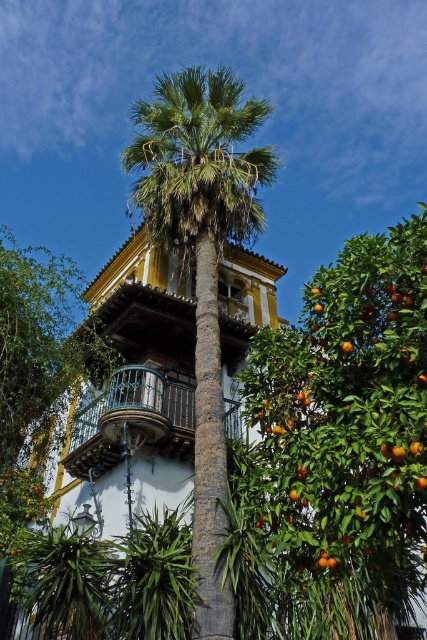
Question: Which of the following is the farthest from the observer?

Choices:
 (A) orange matte/leathery fruit tree at upper right
 (B) black wrought iron balcony at center
 (C) green leafy palm at center

Answer: (B)

Question: Which point appears closest to the camera in this image?

Choices:
 (A) (371, 369)
 (B) (202, 572)
 (C) (173, 401)

Answer: (A)

Question: Does orange matte/leathery fruit tree at upper right come behind green leafy palm at center?

Choices:
 (A) no
 (B) yes

Answer: (A)

Question: Which object is positioned closest to the black wrought iron balcony at center?

Choices:
 (A) green leafy palm at center
 (B) orange matte/leathery fruit tree at upper right

Answer: (B)

Question: Is orange matte/leathery fruit tree at upper right positioned behind black wrought iron balcony at center?

Choices:
 (A) no
 (B) yes

Answer: (A)

Question: In this image, where is orange matte/leathery fruit tree at upper right located relative to green leafy palm at center?

Choices:
 (A) above
 (B) below

Answer: (B)